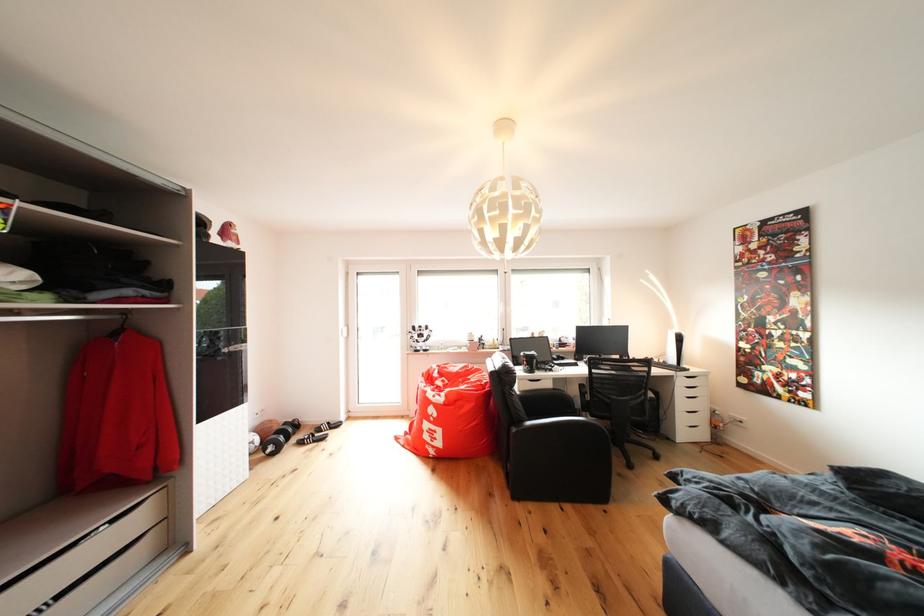
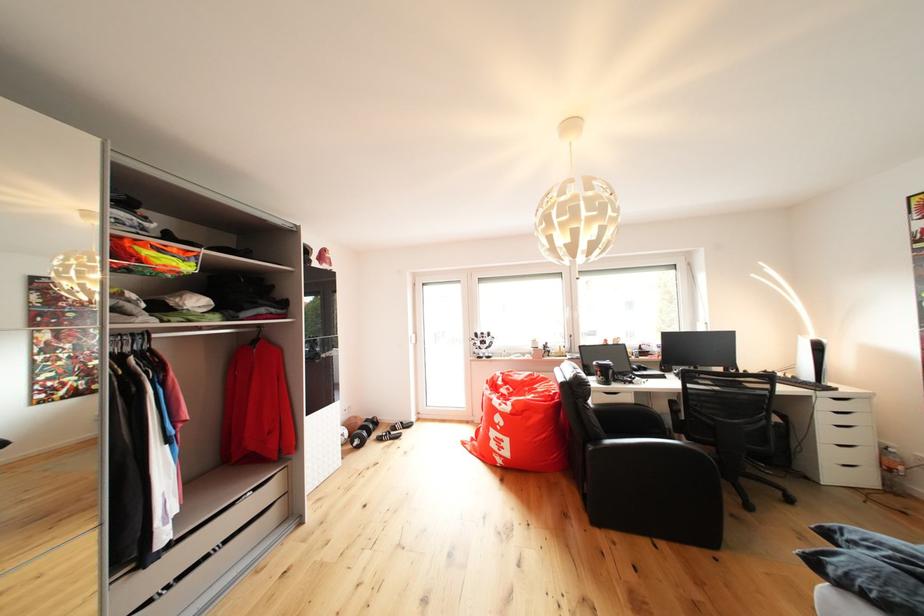
Where in the second image is the point corresponding to [565,385] from the first image?

(647, 399)